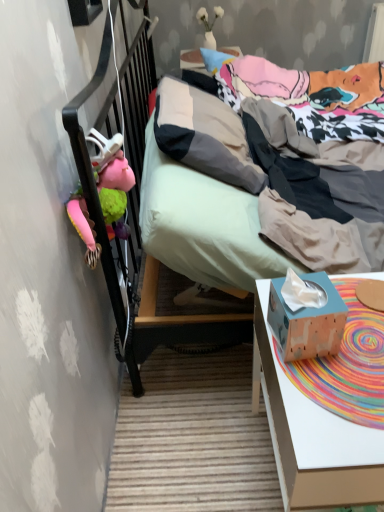
Question: Considering the relative sizes of wooden tissue box at right and pink fabric stuffed animal at left, which ranks as the first toy in left-to-right order, in the image provided, is wooden tissue box at right thinner than pink fabric stuffed animal at left, which ranks as the first toy in left-to-right order,?

Choices:
 (A) no
 (B) yes

Answer: (A)

Question: Does wooden tissue box at right appear on the right side of pink fabric stuffed animal at left, which is counted as the 1th toy, starting from the bottom?

Choices:
 (A) no
 (B) yes

Answer: (B)

Question: Is wooden tissue box at right to the left of pink fabric stuffed animal at left, which is counted as the second toy, starting from the right, from the viewer's perspective?

Choices:
 (A) yes
 (B) no

Answer: (B)

Question: Is wooden tissue box at right oriented towards pink fabric stuffed animal at left, the second toy when ordered from back to front?

Choices:
 (A) no
 (B) yes

Answer: (A)

Question: Is wooden tissue box at right shorter than pink fabric stuffed animal at left, which is counted as the 1th toy, starting from the bottom?

Choices:
 (A) yes
 (B) no

Answer: (B)

Question: Is wooden tissue box at right looking in the opposite direction of pink fabric stuffed animal at left, placed as the 1th toy when sorted from front to back?

Choices:
 (A) no
 (B) yes

Answer: (A)

Question: Considering the relative sizes of wooden tissue box at right and white matte vase at upper center, which is the 1th toy in top-to-bottom order, in the image provided, is wooden tissue box at right bigger than white matte vase at upper center, which is the 1th toy in top-to-bottom order,?

Choices:
 (A) no
 (B) yes

Answer: (B)

Question: Is wooden tissue box at right to the right of white matte vase at upper center, which ranks as the 2th toy in bottom-to-top order, from the viewer's perspective?

Choices:
 (A) yes
 (B) no

Answer: (A)

Question: From a real-world perspective, does wooden tissue box at right stand above white matte vase at upper center, which is the 1th toy in top-to-bottom order?

Choices:
 (A) no
 (B) yes

Answer: (A)

Question: Is wooden tissue box at right thinner than white matte vase at upper center, which is the 1th toy in top-to-bottom order?

Choices:
 (A) no
 (B) yes

Answer: (A)

Question: Is wooden tissue box at right facing away from white matte vase at upper center, which ranks as the second toy in left-to-right order?

Choices:
 (A) no
 (B) yes

Answer: (A)

Question: Is white matte vase at upper center, which ranks as the second toy in left-to-right order, completely or partially inside wooden tissue box at right?

Choices:
 (A) no
 (B) yes

Answer: (A)

Question: Is white matte vase at upper center, which ranks as the second toy in left-to-right order, far away from wooden tissue box at lower right?

Choices:
 (A) no
 (B) yes

Answer: (B)